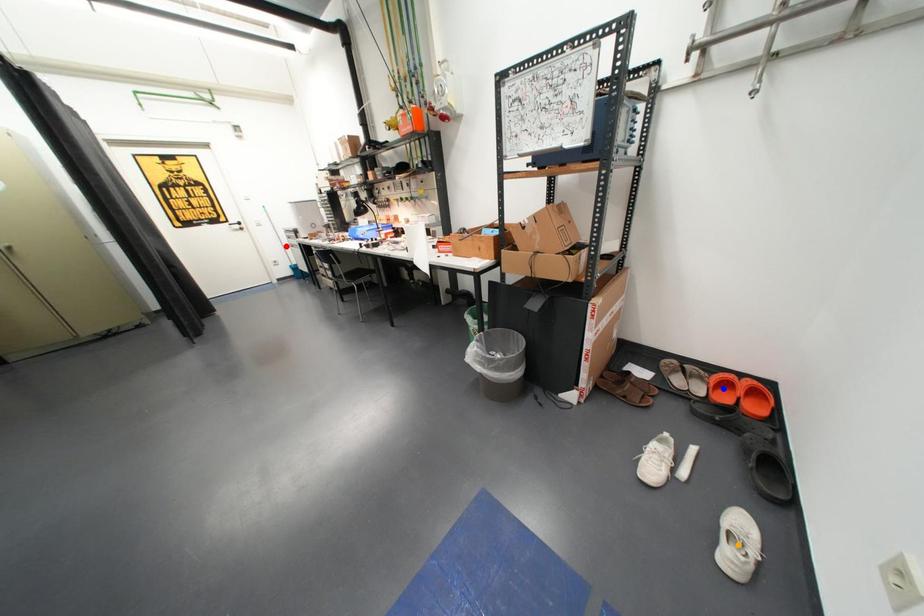
Order these from farthest to nearest:
blue point, red point, orange point

1. red point
2. blue point
3. orange point